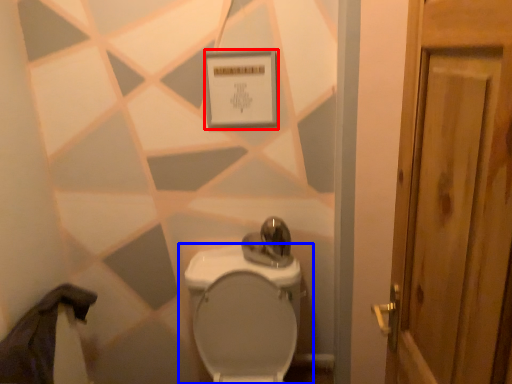
Question: Which point is further to the camera, square (highlighted by a red box) or toilet (highlighted by a blue box)?

Choices:
 (A) square
 (B) toilet

Answer: (A)